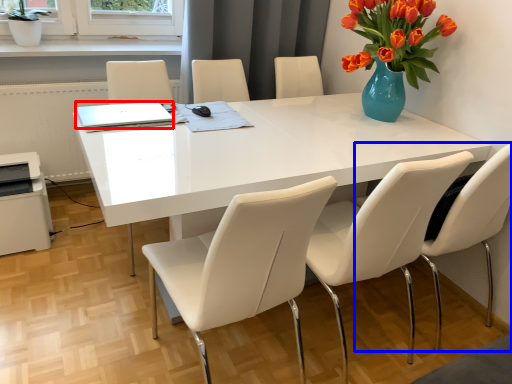
Question: Which object appears closest to the camera in this image, laptop (highlighted by a red box) or chair (highlighted by a blue box)?

Choices:
 (A) laptop
 (B) chair

Answer: (B)